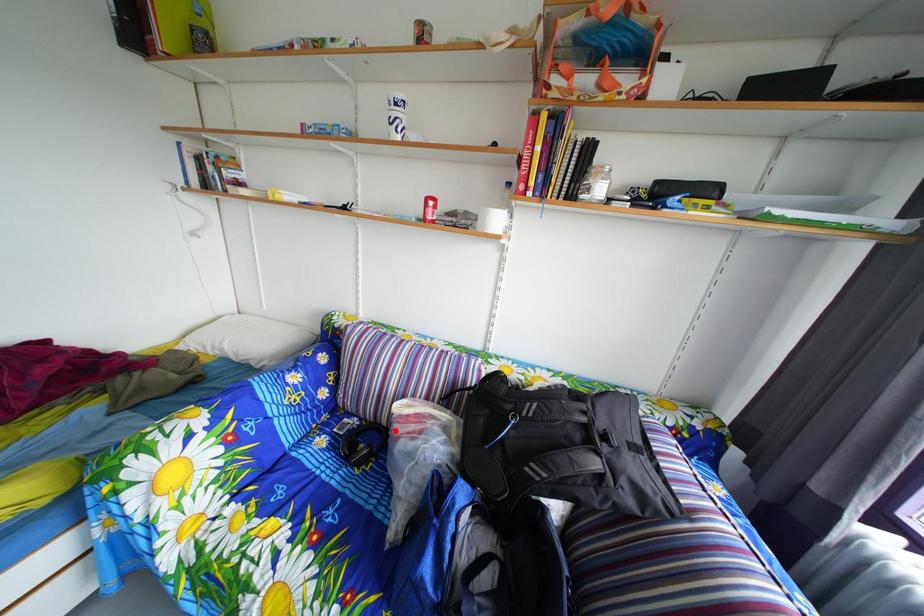
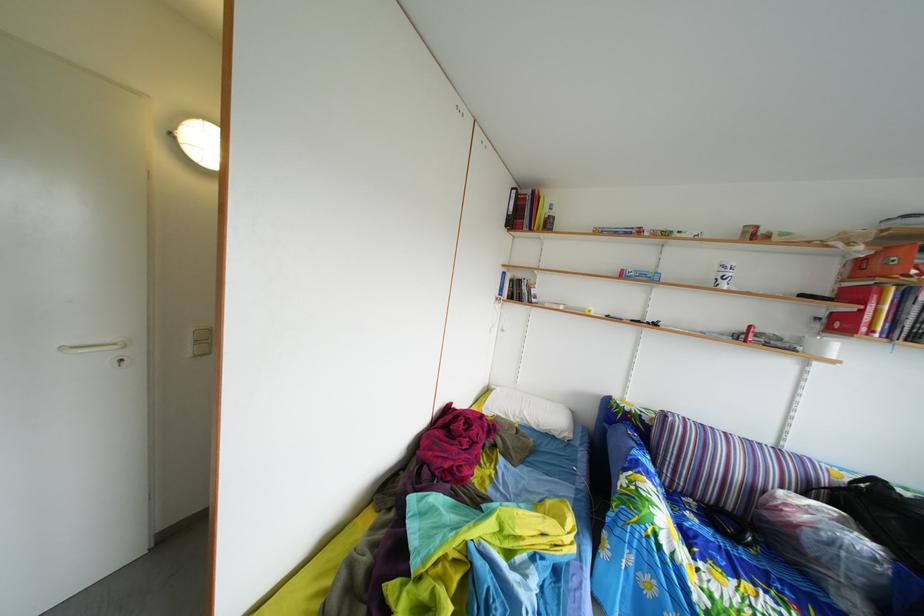
In the second image, find the point that corresponds to the highlighted location in the first image.

(739, 516)